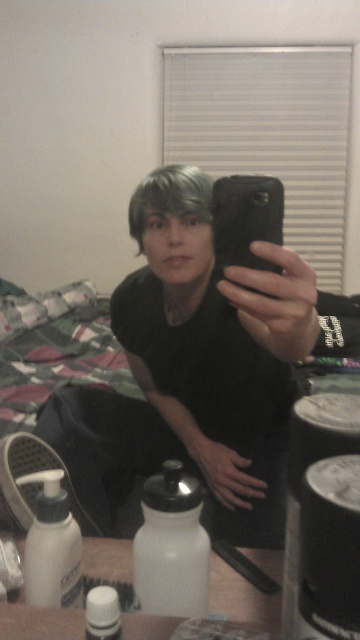
Question: Is black matte phone at center positioned at the back of white plastic pump bottle at lower left?

Choices:
 (A) yes
 (B) no

Answer: (B)

Question: Can you confirm if white matte bottle at center is thinner than white matte water bottle at lower center?

Choices:
 (A) no
 (B) yes

Answer: (A)

Question: Is white matte bottle at center below white matte water bottle at lower center?

Choices:
 (A) no
 (B) yes

Answer: (A)

Question: Among these objects, which one is nearest to the camera?

Choices:
 (A) black matte phone at center
 (B) white matte water bottle at lower center
 (C) gray matte hair at center
 (D) white plastic pump bottle at lower left

Answer: (B)

Question: Based on their relative distances, which object is nearer to the black matte phone at center?

Choices:
 (A) white plastic pump bottle at lower left
 (B) white matte bottle at center

Answer: (A)

Question: Which object is positioned farthest from the white plastic pump bottle at lower left?

Choices:
 (A) white matte water bottle at lower center
 (B) black matte phone at center

Answer: (B)